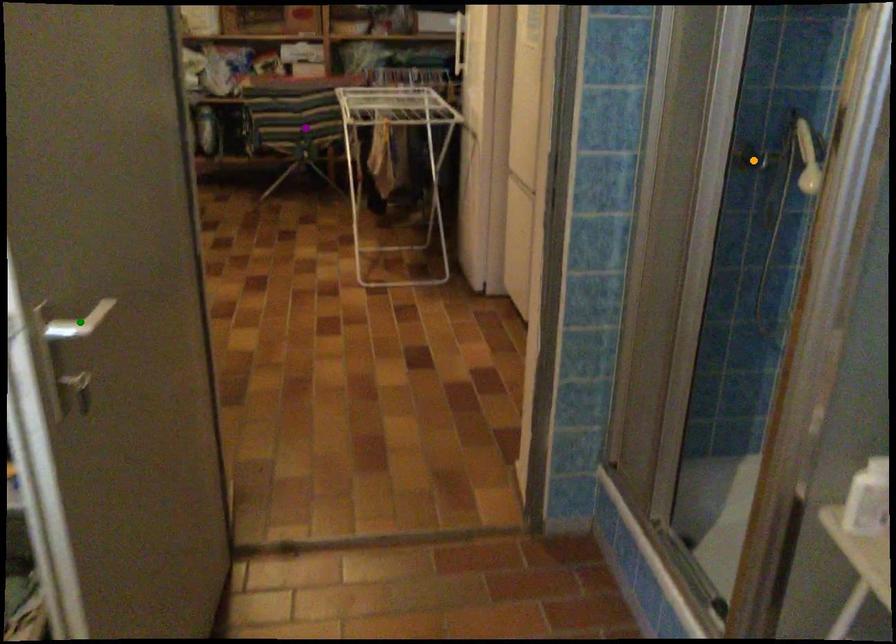
Order these from nearest to farthest:
A) green point
B) purple point
C) orange point

green point
orange point
purple point